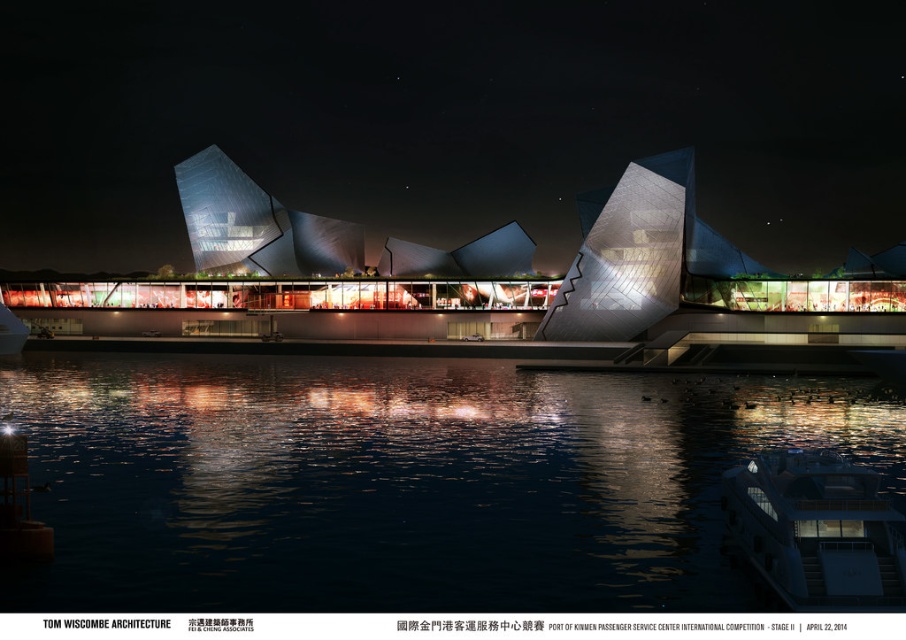
Does sleek glass building at center have a greater width compared to dark reflective water at center?

Indeed, sleek glass building at center has a greater width compared to dark reflective water at center.

Which is behind, point (511, 150) or point (429, 545)?

The point (511, 150) is behind.

Locate an element on the screen. sleek glass building at center is located at coordinates (449, 118).

Can you confirm if sleek glass building at center is smaller than white glossy yacht at lower right?

No.

Does sleek glass building at center have a lesser width compared to white glossy yacht at lower right?

No, sleek glass building at center is not thinner than white glossy yacht at lower right.

What do you see at coordinates (449, 118) in the screenshot?
I see `sleek glass building at center` at bounding box center [449, 118].

At what (x,y) coordinates should I click in order to perform the action: click on sleek glass building at center. Please return your answer as a coordinate pair (x, y). The height and width of the screenshot is (640, 906). Looking at the image, I should click on (449, 118).

The image size is (906, 640). What do you see at coordinates (402, 481) in the screenshot? I see `dark reflective water at center` at bounding box center [402, 481].

Is point (550, 499) less distant than point (749, 552)?

No, it is behind (749, 552).

Who is more distant from viewer, (480, 392) or (770, 508)?

Positioned behind is point (480, 392).

Find the location of a particular element. This screenshot has height=640, width=906. dark reflective water at center is located at coordinates pyautogui.click(x=402, y=481).